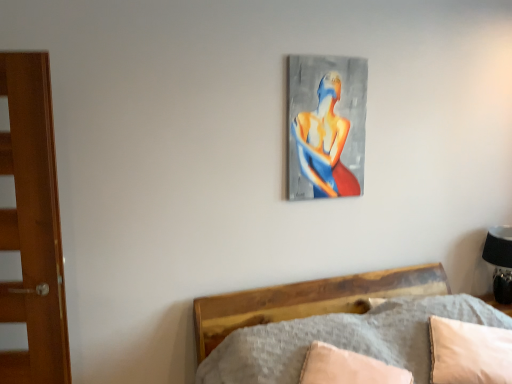
Question: Is black matte table lamp at right located outside abstract painting at upper center?

Choices:
 (A) no
 (B) yes

Answer: (B)

Question: Is abstract painting at upper center at the back of black matte table lamp at right?

Choices:
 (A) no
 (B) yes

Answer: (A)

Question: Is the surface of black matte table lamp at right in direct contact with abstract painting at upper center?

Choices:
 (A) no
 (B) yes

Answer: (A)

Question: Is black matte table lamp at right smaller than abstract painting at upper center?

Choices:
 (A) yes
 (B) no

Answer: (B)

Question: Can you confirm if black matte table lamp at right is shorter than abstract painting at upper center?

Choices:
 (A) no
 (B) yes

Answer: (B)

Question: Do you think black matte table lamp at right is within abstract painting at upper center, or outside of it?

Choices:
 (A) outside
 (B) inside

Answer: (A)

Question: From a real-world perspective, is black matte table lamp at right positioned above or below abstract painting at upper center?

Choices:
 (A) below
 (B) above

Answer: (A)

Question: In terms of width, does black matte table lamp at right look wider or thinner when compared to abstract painting at upper center?

Choices:
 (A) thin
 (B) wide

Answer: (B)

Question: Based on their sizes in the image, would you say black matte table lamp at right is bigger or smaller than abstract painting at upper center?

Choices:
 (A) big
 (B) small

Answer: (A)

Question: From a real-world perspective, is abstract painting at upper center positioned above or below black matte table lamp at right?

Choices:
 (A) above
 (B) below

Answer: (A)

Question: Considering the positions of point (336, 74) and point (496, 286), is point (336, 74) closer or farther from the camera than point (496, 286)?

Choices:
 (A) farther
 (B) closer

Answer: (B)

Question: Based on their sizes in the image, would you say abstract painting at upper center is bigger or smaller than black matte table lamp at right?

Choices:
 (A) small
 (B) big

Answer: (A)

Question: Which is correct: abstract painting at upper center is inside black matte table lamp at right, or outside of it?

Choices:
 (A) inside
 (B) outside

Answer: (B)

Question: Is abstract painting at upper center situated inside beige fabric pillow at lower right, arranged as the first pillow when viewed from the left, or outside?

Choices:
 (A) outside
 (B) inside

Answer: (A)

Question: Relative to beige fabric pillow at lower right, arranged as the second pillow when viewed from the right, is abstract painting at upper center in front or behind?

Choices:
 (A) front
 (B) behind

Answer: (B)